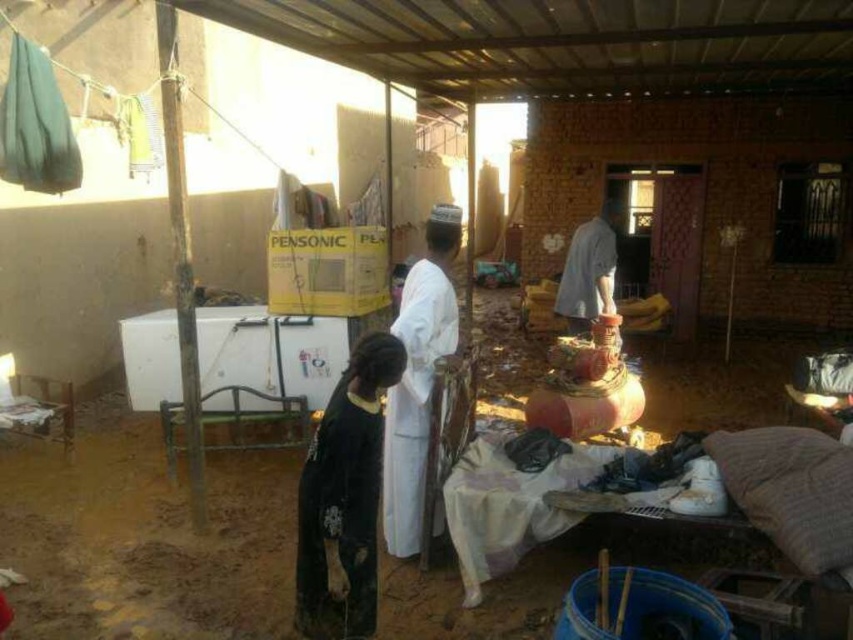
You are a tailor working in this area and need to measure the distance between the black matte robe at lower left and the white matte robe at center. Can you fit a 24 inch ruler between them to take the measurement?

The distance between the black matte robe at lower left and the white matte robe at center is 24.01 inches, so a 24 inch ruler can fit between them with a slight overlap.

You are a photographer taking a portrait of the person wearing the white matte robe at center and the dark gray fabric shirt at center right. To ensure both subjects are in frame, which direction should you position your camera relative to the subjects?

You should position your camera to the left side of the white matte robe at center and dark gray fabric shirt at center right since the white matte robe at center is on the left of the dark gray fabric shirt at center right, ensuring both are in frame.